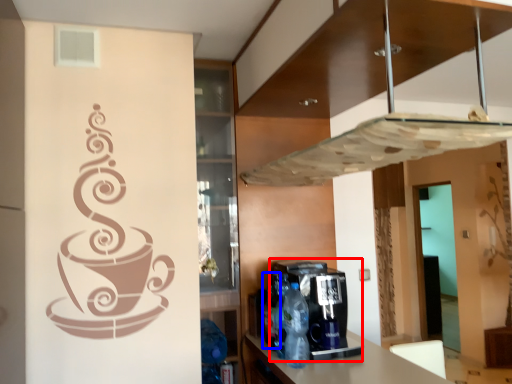
Question: Among these objects, which one is nearest to the camera, coffee machine (highlighted by a red box) or bottle (highlighted by a blue box)?

Choices:
 (A) coffee machine
 (B) bottle

Answer: (A)